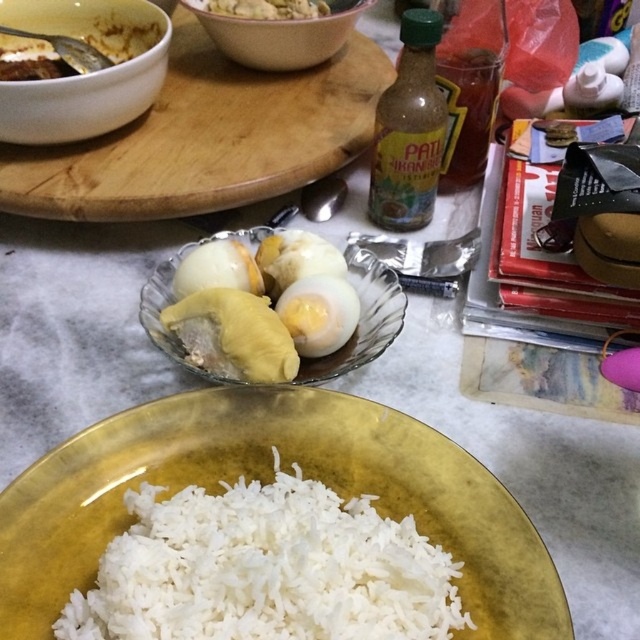
Question: Is wooden cutting board at upper center to the right of yellowish matte durian at center from the viewer's perspective?

Choices:
 (A) no
 (B) yes

Answer: (A)

Question: Is white matte rice at center below yellowish matte durian at center?

Choices:
 (A) yes
 (B) no

Answer: (A)

Question: Based on their relative distances, which object is farther from the white matte rice at center?

Choices:
 (A) smooth white rice at bottom
 (B) translucent glass bowl at center
 (C) yellow matte durian at center
 (D) white matte bowl at upper left

Answer: (A)

Question: Among these points, which one is farthest from the camera?

Choices:
 (A) (221, 189)
 (B) (204, 19)
 (C) (259, 282)

Answer: (B)

Question: Does wooden cutting board at upper center appear under pink ceramic bowl at upper center?

Choices:
 (A) yes
 (B) no

Answer: (A)

Question: Which point is closer to the camera?

Choices:
 (A) wooden cutting board at upper center
 (B) white matte rice at center
 (C) pink ceramic bowl at upper center
 (D) yellowish matte durian at center

Answer: (B)